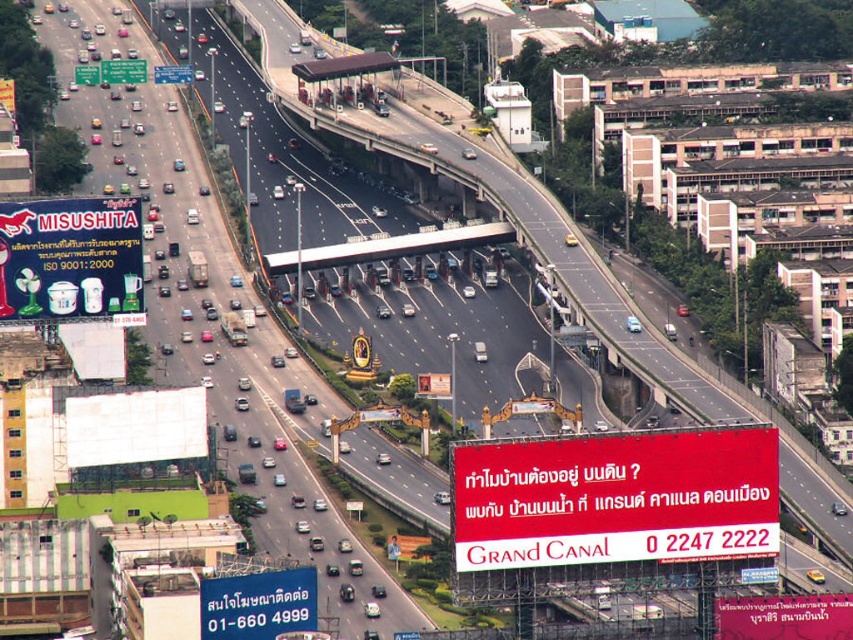
Does point (694, 547) lie in front of point (210, 608)?

That is True.

Does red matte sign at center have a larger size compared to blue plastic sign at lower left?

Correct, red matte sign at center is larger in size than blue plastic sign at lower left.

Who is more distant from viewer, (x=776, y=522) or (x=274, y=608)?

The point (x=274, y=608) is behind.

The width and height of the screenshot is (853, 640). What are the coordinates of `red matte sign at center` in the screenshot? It's located at (614, 497).

Is point (305, 611) closer to viewer compared to point (173, 76)?

Yes, it is.

Which is in front, point (276, 596) or point (160, 76)?

Point (276, 596)

This screenshot has height=640, width=853. In order to click on blue plastic sign at lower left in this screenshot , I will do `click(258, 604)`.

Is point (257, 586) positioned before point (399, 236)?

Yes, point (257, 586) is closer to viewer.

Which of these two, blue plastic sign at lower left or metallic gray overpass at center, stands shorter?

metallic gray overpass at center

The image size is (853, 640). Identify the location of blue plastic sign at lower left. (258, 604).